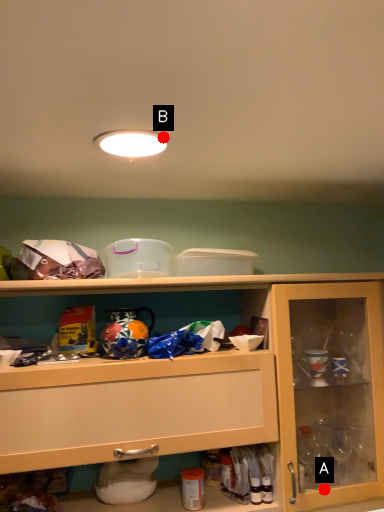
Question: Two points are circled on the image, labeled by A and B beside each circle. Which point is farther from the camera taking this photo?

Choices:
 (A) A is further
 (B) B is further

Answer: (A)